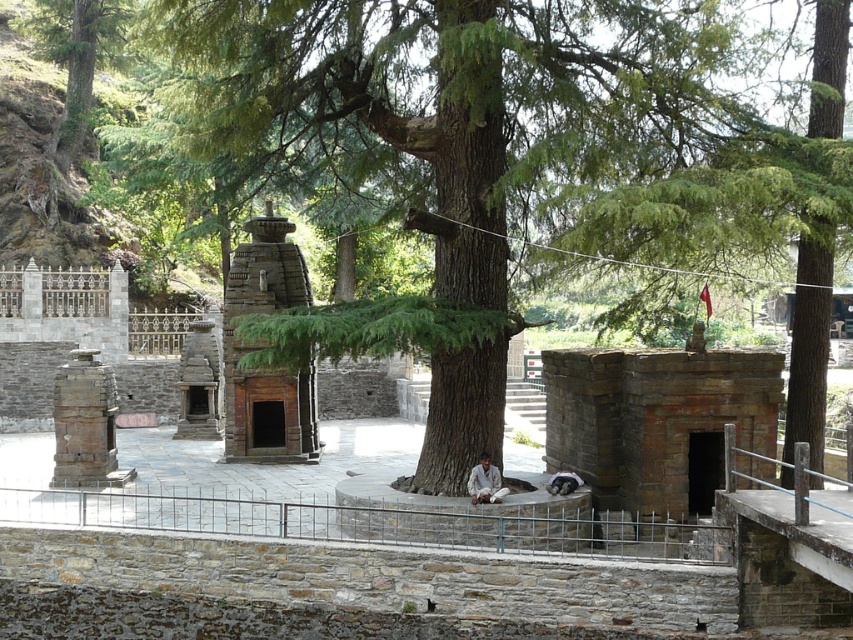
You are a visitor standing at the entrance of the sacred site. You see the green rough bark tree at center and the white cotton dhoti at center. Which object is taller?

The green rough bark tree at center is taller than the white cotton dhoti at center.